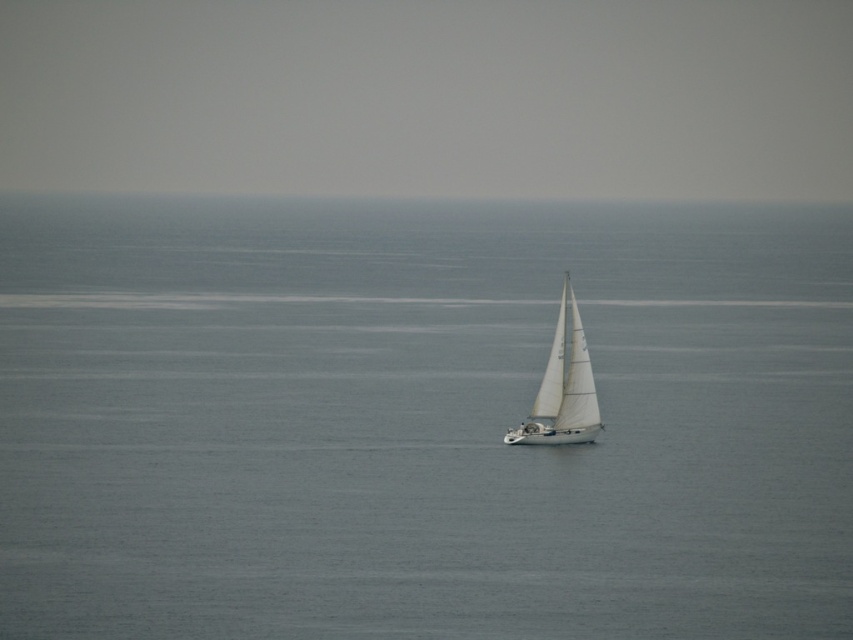
In the scene shown: You are an observer standing on a cliff overlooking the seascape. You notice the gray water at center and the white matte sailboat at center. Which one appears taller from your vantage point?

The gray water at center appears taller than the white matte sailboat at center from your vantage point because the gray water at center has a greater height compared to the white matte sailboat at center.

Based on the coordinates provided, where exactly is the gray water at center located in the image?

The gray water at center is located at the 2D coordinates point (419, 420).